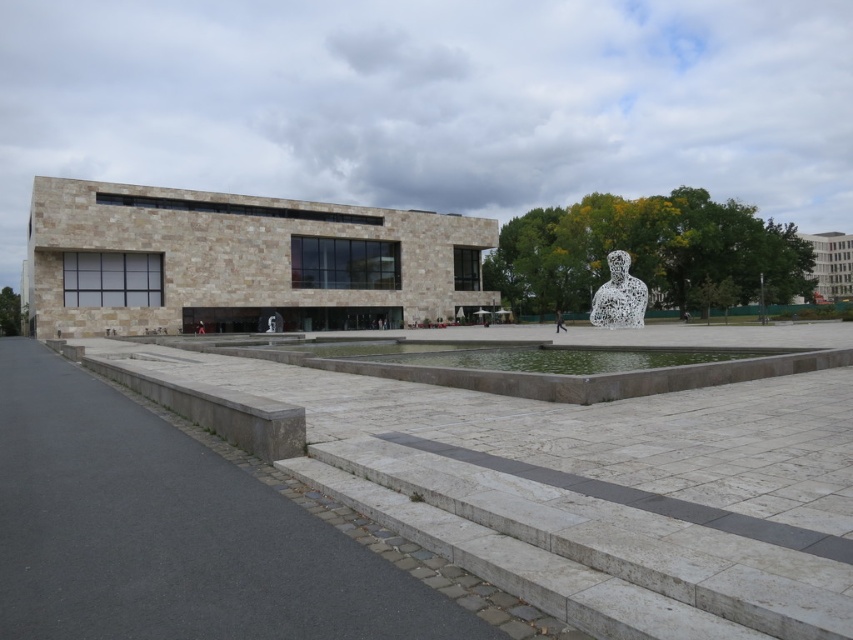
Question: Which of the following is the closest to the observer?

Choices:
 (A) (61, 308)
 (B) (595, 348)
 (C) (607, 312)

Answer: (B)

Question: Based on their relative distances, which object is farther from the beige stone plaza at center?

Choices:
 (A) clear stone water at center
 (B) speckled stone bust at center-right

Answer: (A)

Question: Is beige stone plaza at center positioned before clear stone water at center?

Choices:
 (A) yes
 (B) no

Answer: (B)

Question: Considering the relative positions of beige stone plaza at center and clear stone water at center in the image provided, where is beige stone plaza at center located with respect to clear stone water at center?

Choices:
 (A) below
 (B) above

Answer: (B)

Question: Considering the real-world distances, which object is closest to the clear stone water at center?

Choices:
 (A) beige stone plaza at center
 (B) speckled stone bust at center-right

Answer: (B)

Question: Is beige stone plaza at center above clear stone water at center?

Choices:
 (A) yes
 (B) no

Answer: (A)